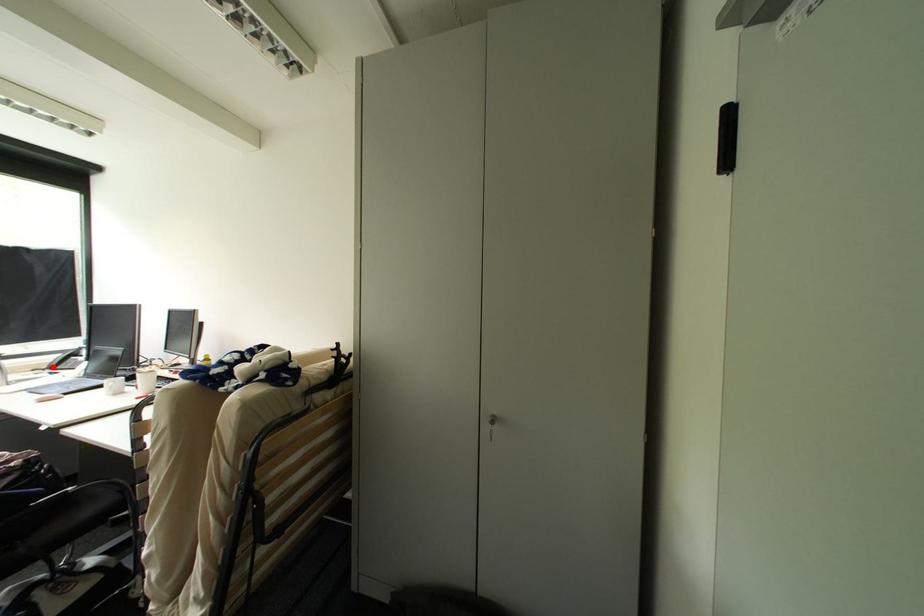
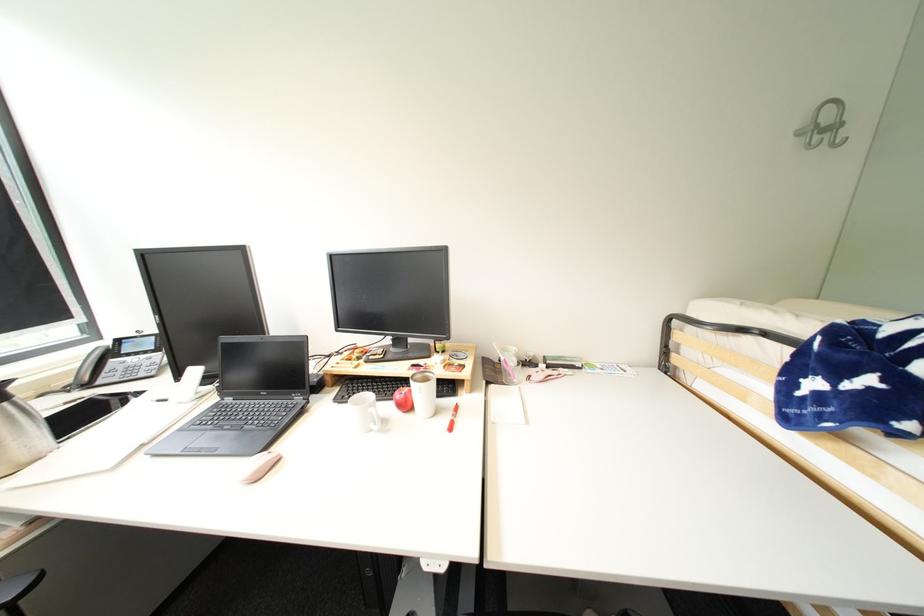
Question: I am providing you with two images of the same scene from different viewpoints. A red point is shown in image1. For the corresponding object point in image2, is it positioned nearer or farther from the camera?

Choices:
 (A) Nearer
 (B) Farther

Answer: (B)